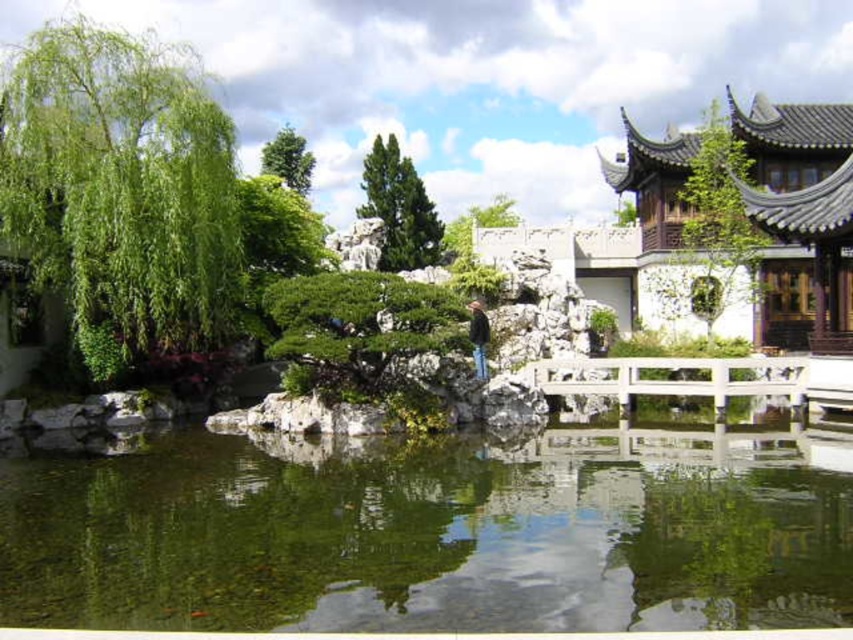
Question: From the image, what is the correct spatial relationship of clear water at center in relation to green leafy tree at upper center?

Choices:
 (A) right
 (B) left

Answer: (A)

Question: Estimate the real-world distances between objects in this image. Which object is farther from the green matte tree at upper right?

Choices:
 (A) green leafy tree at center
 (B) white stone temple at upper right
 (C) white wooden bridge at center

Answer: (C)

Question: Is white stone temple at upper right wider than green leafy tree at upper center?

Choices:
 (A) yes
 (B) no

Answer: (A)

Question: From the image, what is the correct spatial relationship of green textured tree at center in relation to green leafy tree at center?

Choices:
 (A) below
 (B) above

Answer: (B)

Question: Which point is closer to the camera taking this photo?

Choices:
 (A) (496, 198)
 (B) (701, 284)

Answer: (B)

Question: Among these points, which one is nearest to the camera?

Choices:
 (A) (601, 380)
 (B) (682, 166)
 (C) (175, 182)

Answer: (C)